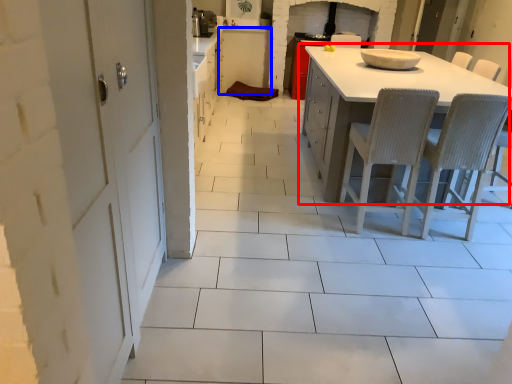
Question: Among these objects, which one is farthest to the camera, table (highlighted by a red box) or cabinetry (highlighted by a blue box)?

Choices:
 (A) table
 (B) cabinetry

Answer: (B)